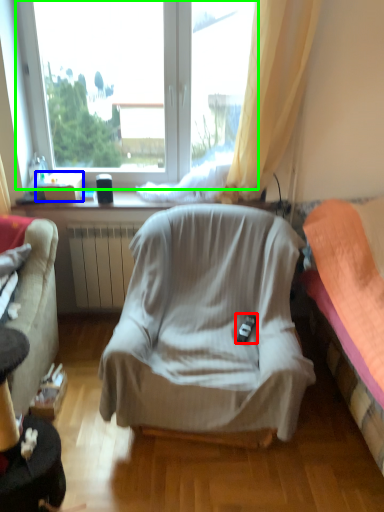
Question: Estimate the real-world distances between objects in this image. Which object is closer to remote control (highlighted by a red box), box (highlighted by a blue box) or window (highlighted by a green box)?

Choices:
 (A) box
 (B) window

Answer: (A)